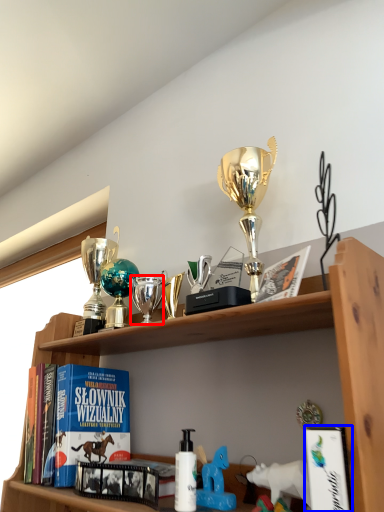
Question: Which of the following is the closest to the observer, toy (highlighted by a red box) or book (highlighted by a blue box)?

Choices:
 (A) toy
 (B) book

Answer: (B)